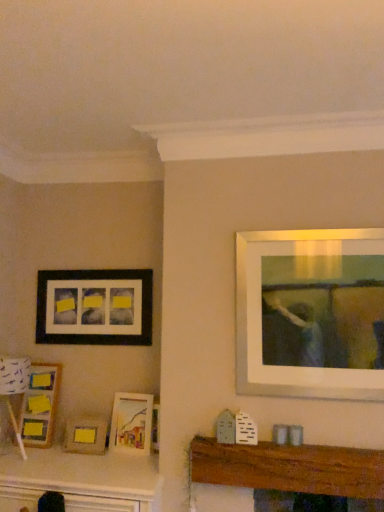
Find the location of a particular element. This screenshot has width=384, height=512. free point above matte black picture frame at left, which appears as the first picture frame when viewed from the top (from a real-world perspective) is located at coordinates (92, 265).